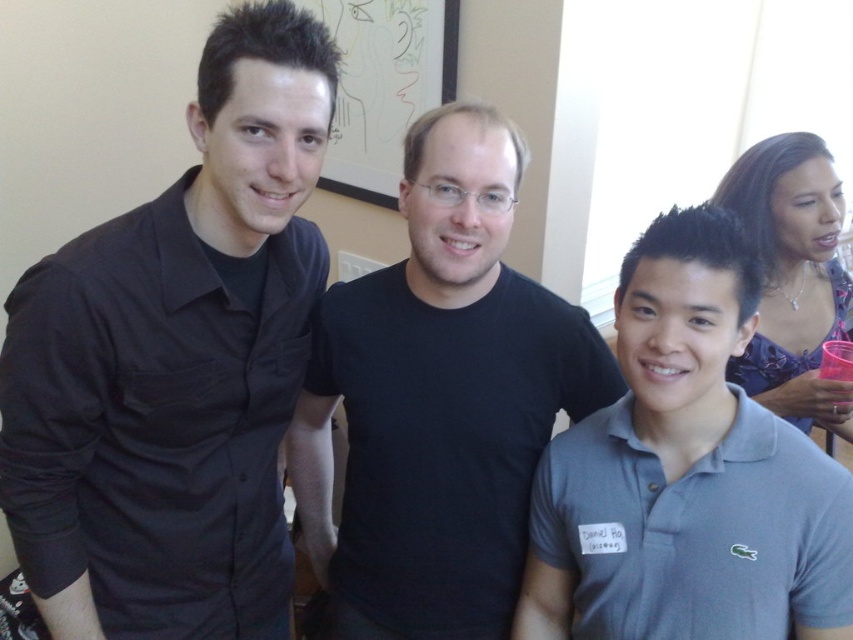
In the scene shown: Is black matte shirt at left to the right of black matte t-shirt at center from the viewer's perspective?

Incorrect, black matte shirt at left is not on the right side of black matte t-shirt at center.

I want to click on black matte shirt at left, so click(177, 364).

I want to click on black matte shirt at left, so click(177, 364).

Can you confirm if black matte t-shirt at center is bigger than blue floral dress at upper right?

Yes.

Can you confirm if black matte t-shirt at center is taller than blue floral dress at upper right?

Yes, black matte t-shirt at center is taller than blue floral dress at upper right.

Image resolution: width=853 pixels, height=640 pixels. Identify the location of black matte t-shirt at center. (439, 400).

Which is more to the right, black matte shirt at left or blue floral dress at upper right?

blue floral dress at upper right

The width and height of the screenshot is (853, 640). What are the coordinates of `black matte shirt at left` in the screenshot? It's located at tap(177, 364).